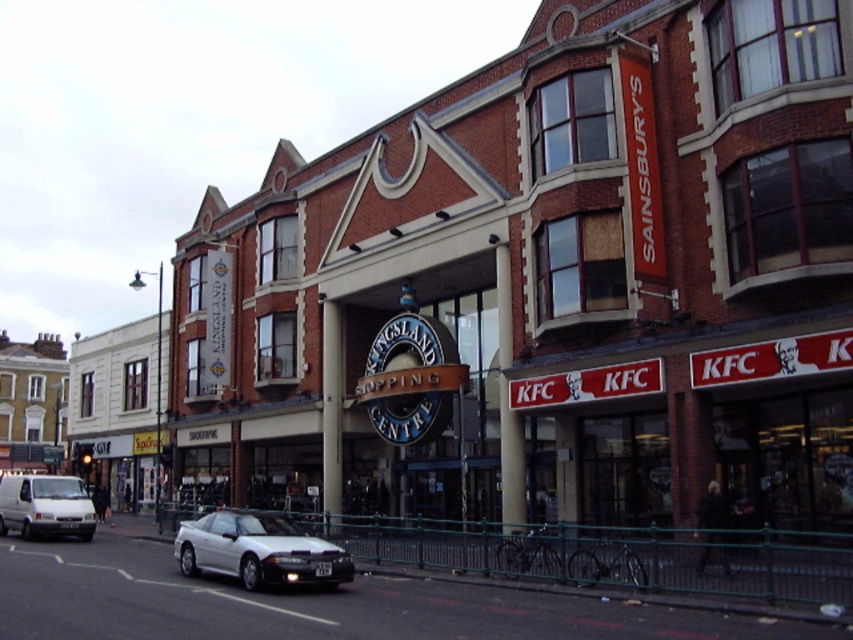
Question: Is white glossy car at lower left closer to the viewer compared to white matte van at lower left?

Choices:
 (A) yes
 (B) no

Answer: (A)

Question: Which point is farther to the camera?

Choices:
 (A) white glossy car at lower left
 (B) white matte van at lower left

Answer: (B)

Question: Which point is closer to the camera?

Choices:
 (A) (20, 499)
 (B) (192, 525)

Answer: (B)

Question: Is white glossy car at lower left above white matte van at lower left?

Choices:
 (A) no
 (B) yes

Answer: (B)

Question: Can you confirm if white glossy car at lower left is wider than white matte van at lower left?

Choices:
 (A) no
 (B) yes

Answer: (A)